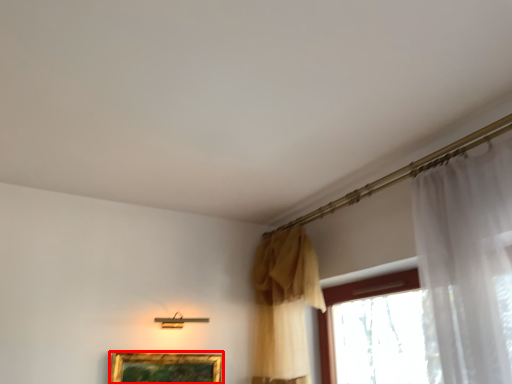
Question: From the image, what is the correct spatial relationship of picture frame (annotated by the red box) in relation to curtain?

Choices:
 (A) left
 (B) right

Answer: (A)